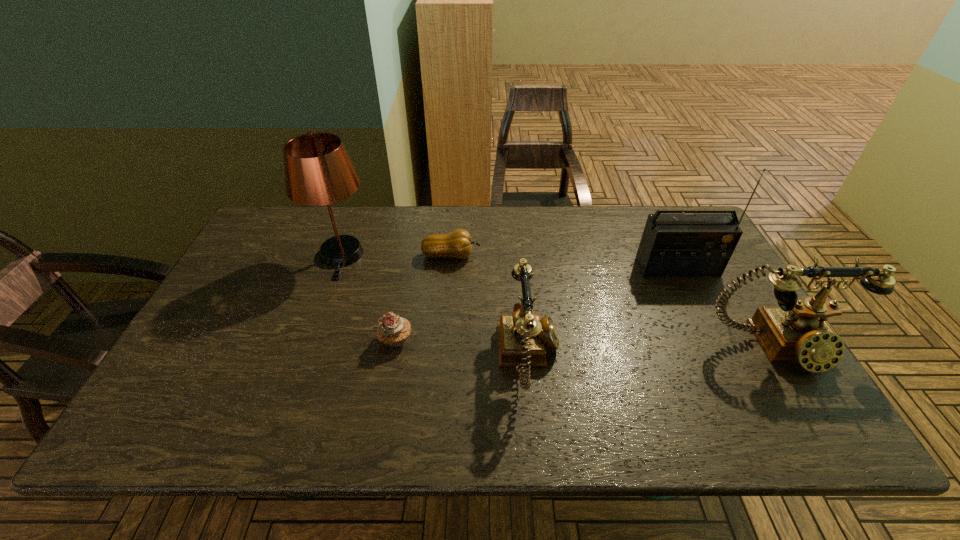
Where is `vacant spot to place a telephone on the left`? This screenshot has width=960, height=540. vacant spot to place a telephone on the left is located at coordinates (272, 368).